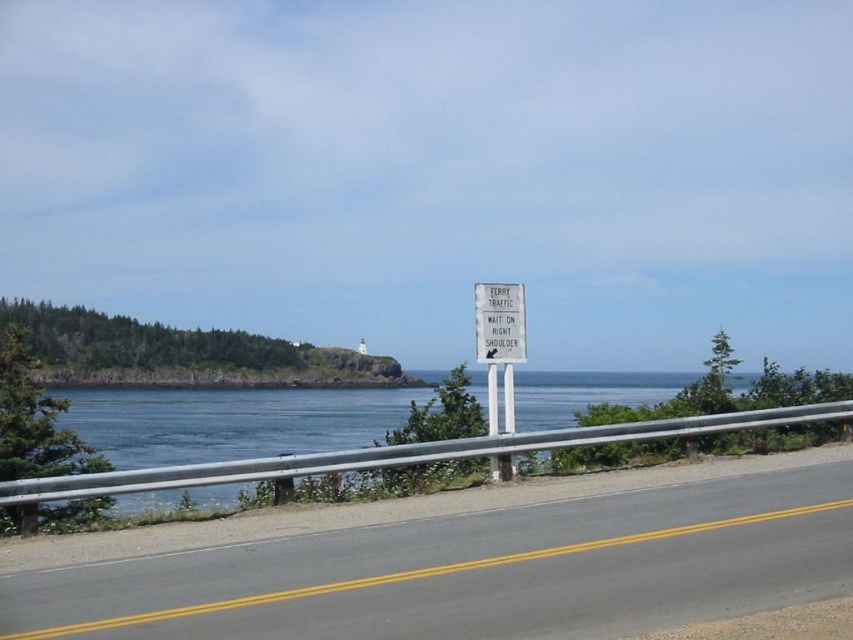
Based on the photo, you are standing on the side of the road and want to cross the gray asphalt road at center to reach the ocean. The road has a double yellow line. Can you safely cross the road here?

The gray asphalt road at center is 7.39 meters from viewer, so it is too far to cross safely. Wait for a closer point with better visibility and no double yellow lines.

You are driving a delivery truck and see the gray asphalt road at center and the white plastic sign at center ahead. Which object will occupy more of your windshield view as you approach them?

The white plastic sign at center will occupy more of your windshield view as you approach because it is larger than the gray asphalt road at center according to the description.

You are driving along the gray asphalt road at center and see the white plastic sign at center ahead. Which object is closer to you as you drive forward?

The gray asphalt road at center is closer to the viewer than the white plastic sign at center, so the road is closer as you drive forward.